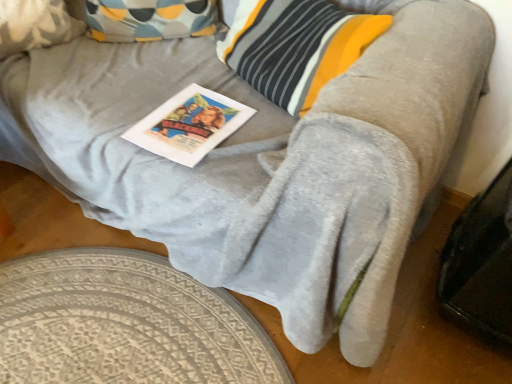
Question: Are textured beige rug at lower left and fluffy beige pillow at upper left far apart?

Choices:
 (A) no
 (B) yes

Answer: (A)

Question: Can you confirm if textured beige rug at lower left is wider than fluffy beige pillow at upper left?

Choices:
 (A) yes
 (B) no

Answer: (A)

Question: Is the depth of textured beige rug at lower left greater than that of fluffy beige pillow at upper left?

Choices:
 (A) no
 (B) yes

Answer: (A)

Question: From the image's perspective, is textured beige rug at lower left on top of fluffy beige pillow at upper left?

Choices:
 (A) yes
 (B) no

Answer: (B)

Question: Can we say textured beige rug at lower left lies outside fluffy beige pillow at upper left?

Choices:
 (A) no
 (B) yes

Answer: (B)

Question: Is textured beige rug at lower left with fluffy beige pillow at upper left?

Choices:
 (A) no
 (B) yes

Answer: (A)

Question: Considering the relative sizes of white paper magazine at center and fluffy beige pillow at upper left in the image provided, is white paper magazine at center thinner than fluffy beige pillow at upper left?

Choices:
 (A) no
 (B) yes

Answer: (A)

Question: Does white paper magazine at center appear on the left side of fluffy beige pillow at upper left?

Choices:
 (A) yes
 (B) no

Answer: (B)

Question: Considering the relative sizes of white paper magazine at center and fluffy beige pillow at upper left in the image provided, is white paper magazine at center wider than fluffy beige pillow at upper left?

Choices:
 (A) no
 (B) yes

Answer: (B)

Question: Is white paper magazine at center turned away from fluffy beige pillow at upper left?

Choices:
 (A) yes
 (B) no

Answer: (B)

Question: Can you confirm if white paper magazine at center is smaller than fluffy beige pillow at upper left?

Choices:
 (A) no
 (B) yes

Answer: (B)

Question: From a real-world perspective, is white paper magazine at center on top of fluffy beige pillow at upper left?

Choices:
 (A) yes
 (B) no

Answer: (B)

Question: From a real-world perspective, does fluffy beige pillow at upper left sit lower than white paper magazine at center?

Choices:
 (A) no
 (B) yes

Answer: (A)